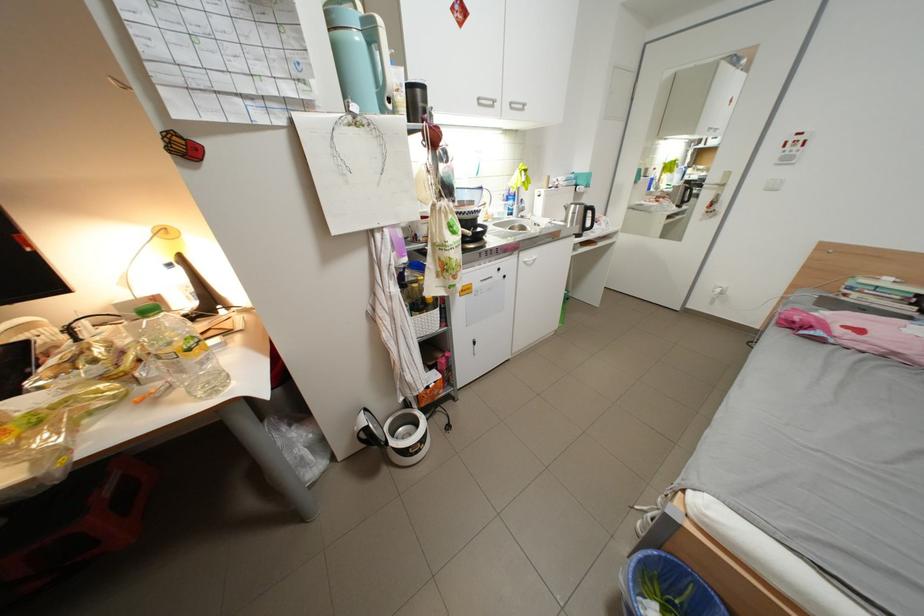
Find where to pull the white cabinet handle. Please return your answer as a coordinate pair (x, y).

(492, 60)